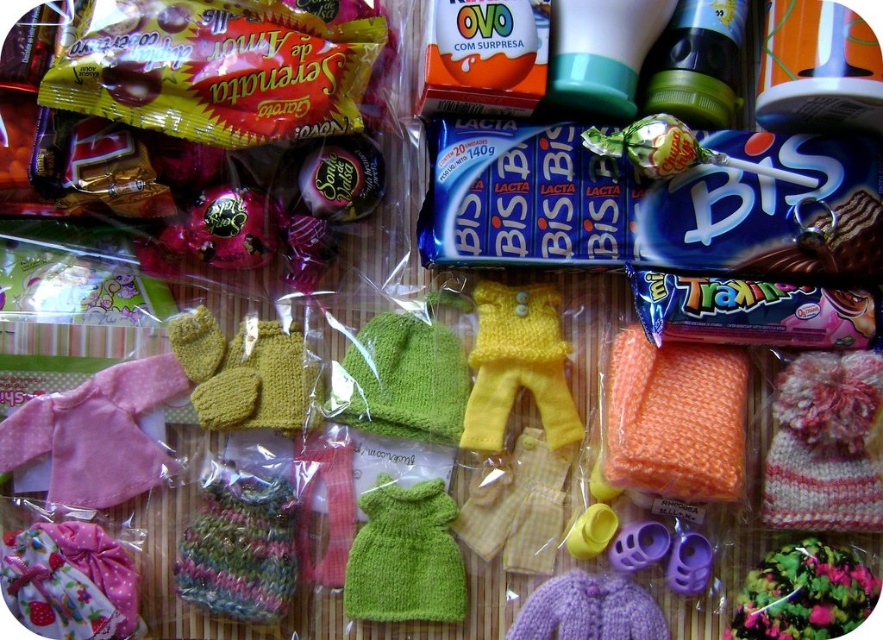
Can you confirm if floral fabric dress at lower left is taller than yellow knitted gloves at center?

In fact, floral fabric dress at lower left may be shorter than yellow knitted gloves at center.

Does floral fabric dress at lower left appear under yellow knitted gloves at center?

Indeed, floral fabric dress at lower left is positioned under yellow knitted gloves at center.

Find the location of a particular element. The image size is (883, 640). floral fabric dress at lower left is located at coordinates (69, 580).

Can you confirm if purple knitted sweater at center is positioned to the right of shiny chocolate at center?

Indeed, purple knitted sweater at center is positioned on the right side of shiny chocolate at center.

Is purple knitted sweater at center further to the viewer compared to shiny chocolate at center?

No.

Identify the location of purple knitted sweater at center. The height and width of the screenshot is (640, 883). (587, 609).

Is orange knitted sweater at center right behind yellow knitted pants at center?

No, orange knitted sweater at center right is closer to the viewer.

Between orange knitted sweater at center right and yellow knitted pants at center, which one has more height?

With more height is yellow knitted pants at center.

Is point (623, 444) closer to viewer compared to point (466, 448)?

Yes.

Locate an element on the screen. This screenshot has height=640, width=883. orange knitted sweater at center right is located at coordinates (675, 419).